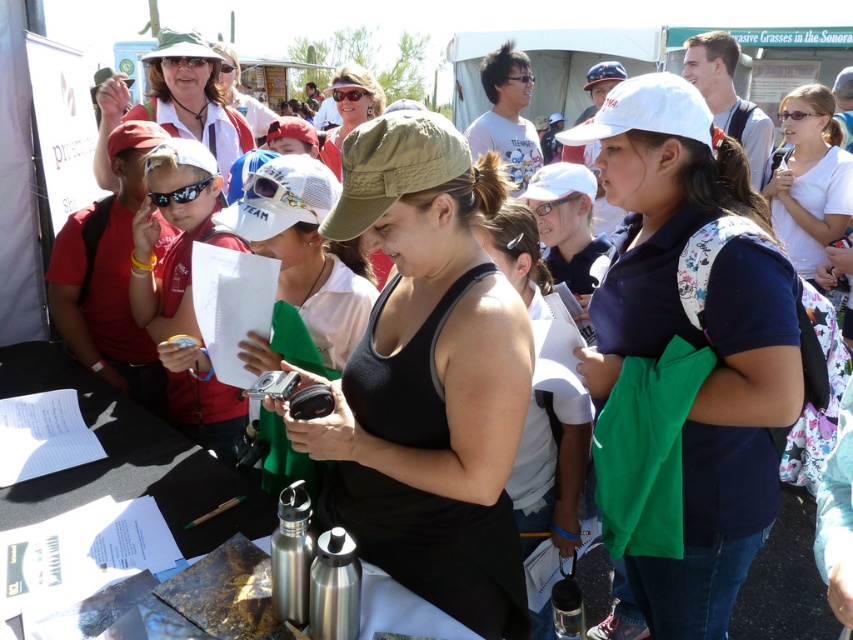
You are standing at the center of the image and want to locate the white cotton shirt at upper right. According to the coordinates given, in which direction should you look to find it?

The white cotton shirt at upper right is located at point coordinates 0.278 on the x axis and 0.950 on the y axis. Since you are at the center, looking towards the upper right direction would align with the shirt.

Based on the photo, you are a photographer at the event and need to take a photo of both the white cotton shirt at upper right and the green fabric baseball cap at center. Which object should you focus on first to ensure both are in the frame?

You should focus on the green fabric baseball cap at center first because it is closer to the viewer than the white cotton shirt at upper right, ensuring both will be in the frame when adjusted properly.

You are organizing a photo shoot and need to ensure that the clothing items in the scene are arranged properly. Which clothing item, the black matte tank top at center or the matte white hat at upper center, has a smaller width and should be placed in the designated smaller storage compartment?

The black matte tank top at center has a lesser width compared to the matte white hat at upper center, so it should be placed in the designated smaller storage compartment.